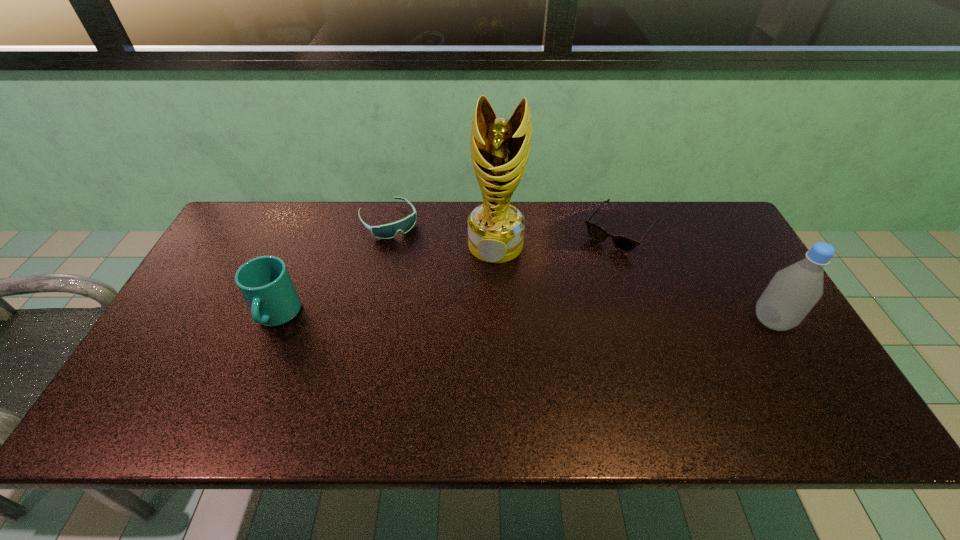
The height and width of the screenshot is (540, 960). I want to click on the third tallest object, so click(265, 283).

Identify the location of the leftmost object. (265, 283).

This screenshot has width=960, height=540. What are the coordinates of `the rightmost object` in the screenshot? It's located at (793, 291).

The image size is (960, 540). Identify the location of the fourth shortest object. (793, 291).

This screenshot has height=540, width=960. I want to click on the tallest object, so click(x=500, y=148).

The image size is (960, 540). Find the location of `award`. award is located at coordinates (500, 148).

Find the location of a particular element. sunglasses is located at coordinates (622, 243).

Locate an element on the screen. goggles is located at coordinates (387, 231).

I want to click on vacant region located 0.120m on the handle side of the leftmost object, so click(x=250, y=382).

The width and height of the screenshot is (960, 540). I want to click on free spot located on the back of the rightmost object, so click(743, 272).